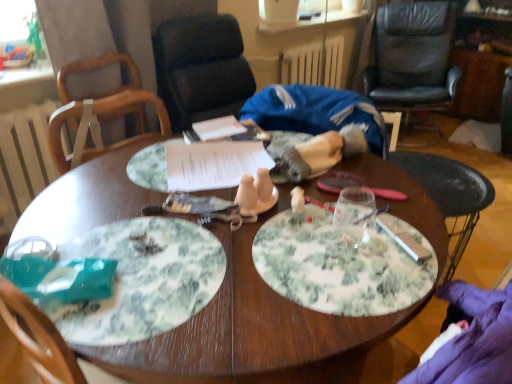
The image size is (512, 384). What are the coordinates of `vacant region to the right of white crumbly food at center` in the screenshot? It's located at (204, 261).